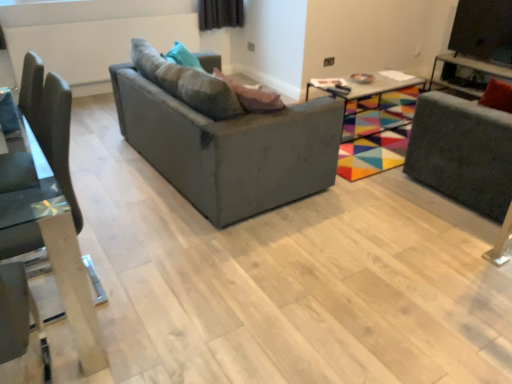
Question: Considering the relative positions of matte gray couch at center and velvet grey swivel chair at right in the image provided, is matte gray couch at center to the right of velvet grey swivel chair at right from the viewer's perspective?

Choices:
 (A) yes
 (B) no

Answer: (B)

Question: Does matte gray couch at center have a smaller size compared to velvet grey swivel chair at right?

Choices:
 (A) no
 (B) yes

Answer: (A)

Question: Would you say matte gray couch at center is a long distance from velvet grey swivel chair at right?

Choices:
 (A) yes
 (B) no

Answer: (A)

Question: Can you confirm if matte gray couch at center is shorter than velvet grey swivel chair at right?

Choices:
 (A) no
 (B) yes

Answer: (B)

Question: Considering the relative sizes of matte gray couch at center and velvet grey swivel chair at right in the image provided, is matte gray couch at center wider than velvet grey swivel chair at right?

Choices:
 (A) yes
 (B) no

Answer: (A)

Question: Do you think transparent glass chair at left is within metallic silver tv stand at upper right, the 2th table positioned from the left, or outside of it?

Choices:
 (A) inside
 (B) outside

Answer: (B)

Question: From a real-world perspective, is transparent glass chair at left physically located above or below metallic silver tv stand at upper right, which is the first table in right-to-left order?

Choices:
 (A) below
 (B) above

Answer: (B)

Question: Does point pyautogui.click(x=78, y=283) appear closer or farther from the camera than point pyautogui.click(x=500, y=66)?

Choices:
 (A) closer
 (B) farther

Answer: (A)

Question: Would you say transparent glass chair at left is to the left or to the right of metallic silver tv stand at upper right, which is the first table in right-to-left order, in the picture?

Choices:
 (A) left
 (B) right

Answer: (A)

Question: Based on their positions, is velvet grey swivel chair at right located to the left or right of multicolored fabric table at center, marked as the 1th table in a left-to-right arrangement?

Choices:
 (A) left
 (B) right

Answer: (B)

Question: Considering their positions, is velvet grey swivel chair at right located in front of or behind multicolored fabric table at center, marked as the 1th table in a left-to-right arrangement?

Choices:
 (A) front
 (B) behind

Answer: (A)

Question: Would you say velvet grey swivel chair at right is inside or outside multicolored fabric table at center, marked as the 1th table in a left-to-right arrangement?

Choices:
 (A) outside
 (B) inside

Answer: (A)

Question: From a real-world perspective, is velvet grey swivel chair at right physically located above or below multicolored fabric table at center, placed as the second table when sorted from right to left?

Choices:
 (A) above
 (B) below

Answer: (A)

Question: Is transparent glass chair at left spatially inside velvet grey swivel chair at right, or outside of it?

Choices:
 (A) inside
 (B) outside

Answer: (B)

Question: Based on their positions, is transparent glass chair at left located to the left or right of velvet grey swivel chair at right?

Choices:
 (A) left
 (B) right

Answer: (A)